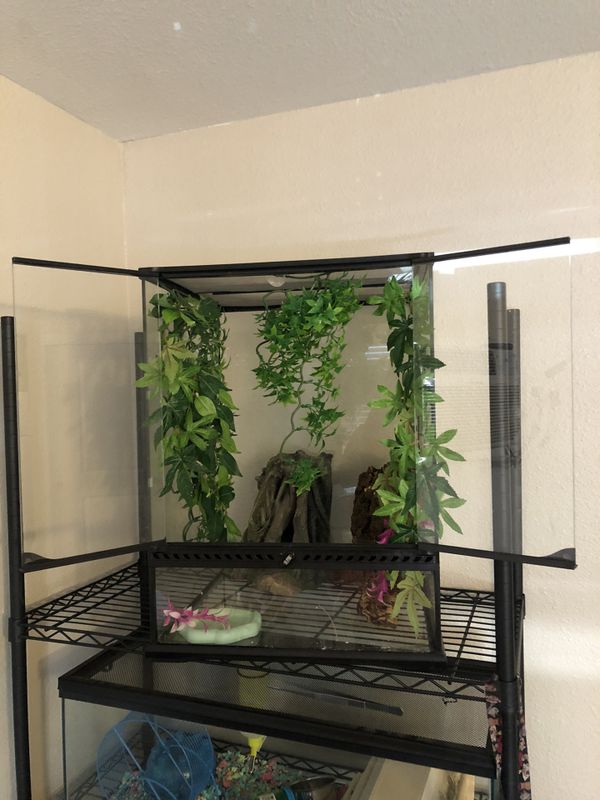
You are a GUI agent. You are given a task and a screenshot of the screen. Output one action in this format:
    pyautogui.click(x=<x>, y=<y>)
    Task: Click on the water dish
    The height and width of the screenshot is (800, 600).
    Given the screenshot: What is the action you would take?
    pyautogui.click(x=237, y=621)